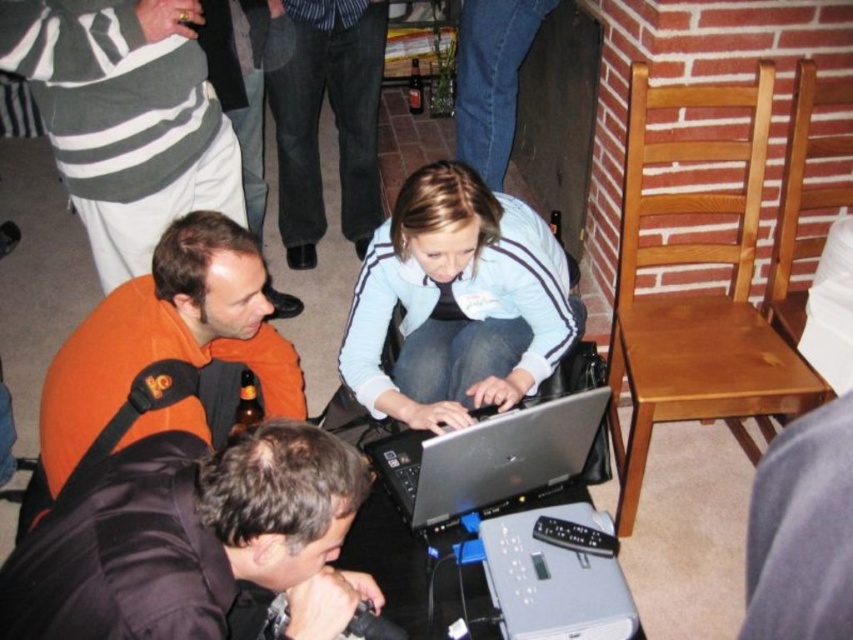
Question: Among these objects, which one is nearest to the camera?

Choices:
 (A) jeans at center
 (B) silver metallic projector at lower center
 (C) black matte jacket at lower left
 (D) silver metallic laptop at center

Answer: (C)

Question: Which object is positioned closest to the jeans at center?

Choices:
 (A) silver metallic projector at lower center
 (B) light blue fabric jacket at center

Answer: (B)

Question: Is light blue fabric jacket at center wider than orange fleece jacket at lower left?

Choices:
 (A) yes
 (B) no

Answer: (A)

Question: Observing the image, what is the correct spatial positioning of black matte jacket at lower left in reference to orange fleece jacket at lower left?

Choices:
 (A) below
 (B) above

Answer: (A)

Question: Is black matte jacket at lower left to the left of silver metallic laptop at center from the viewer's perspective?

Choices:
 (A) yes
 (B) no

Answer: (A)

Question: Estimate the real-world distances between objects in this image. Which object is farther from the light blue fabric jacket at center?

Choices:
 (A) silver metallic laptop at center
 (B) jeans at center
 (C) silver metallic projector at lower center

Answer: (B)